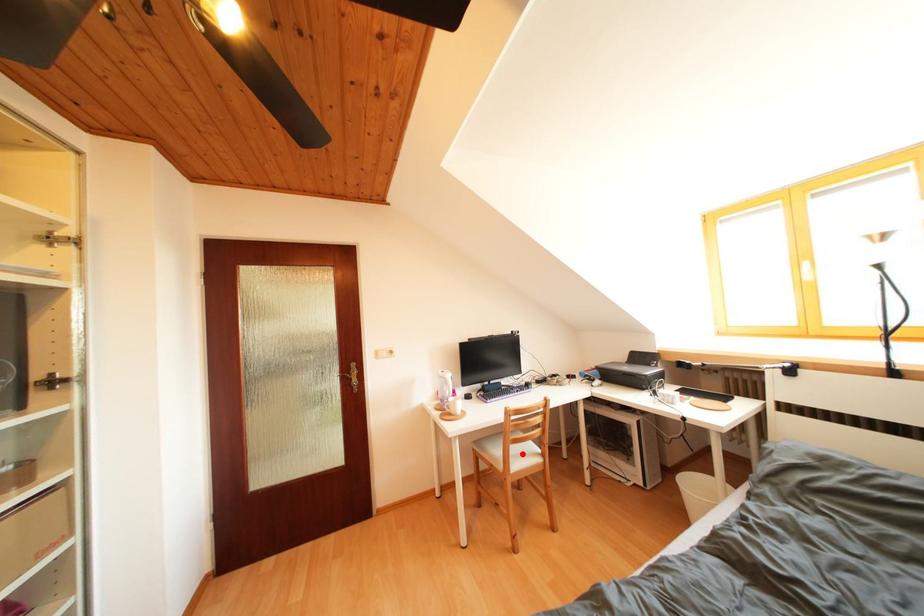
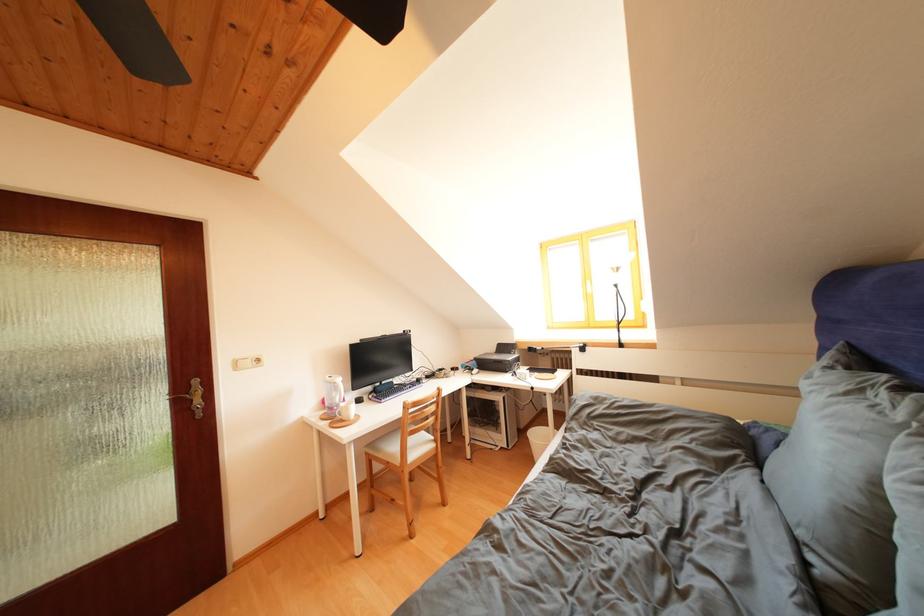
Find the pixel in the second image that matches the highlighted location in the first image.

(419, 446)